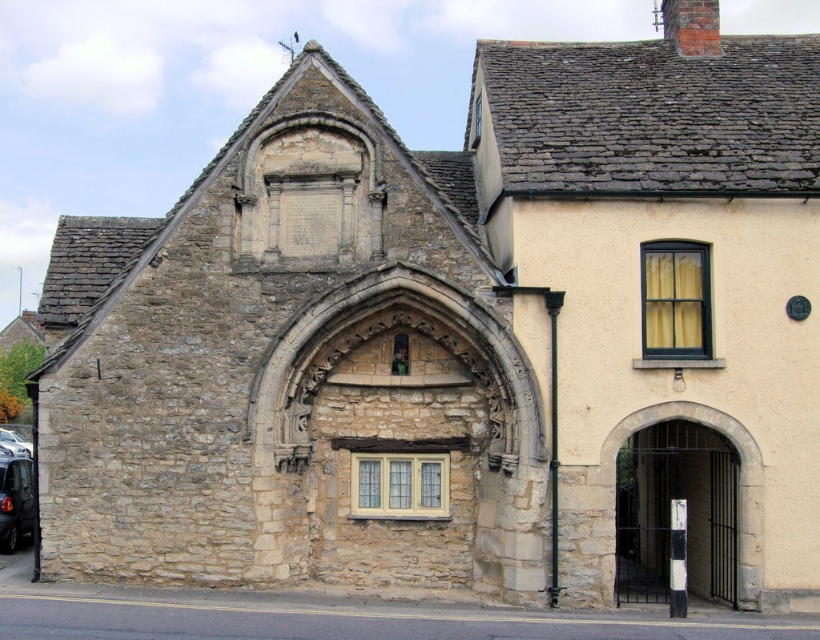
Is dark gray metallic car at lower left above metallic silver car at lower left?

Yes.

Where is `dark gray metallic car at lower left`? The image size is (820, 640). dark gray metallic car at lower left is located at coordinates (14, 502).